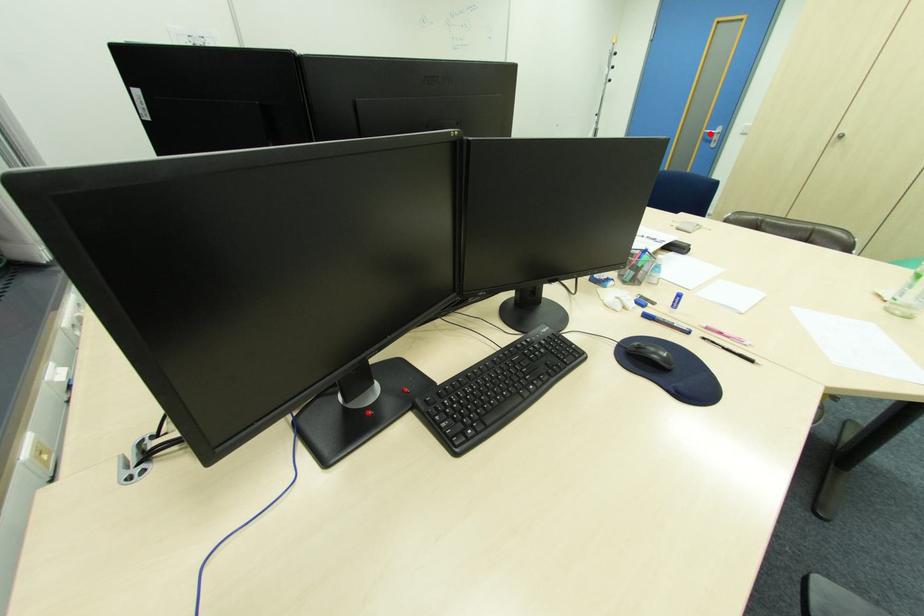
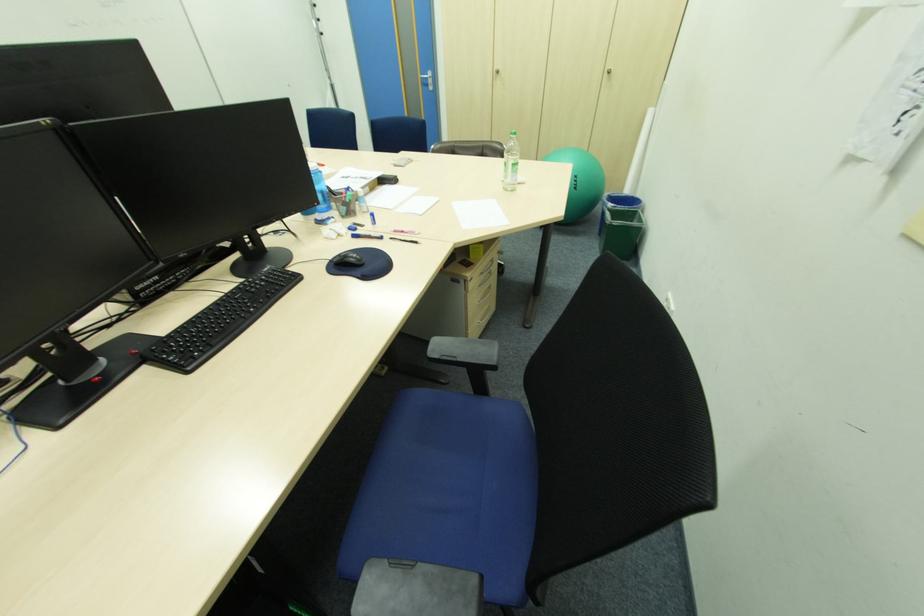
Find the pixel in the second image that matches the highlighted location in the first image.

(428, 79)